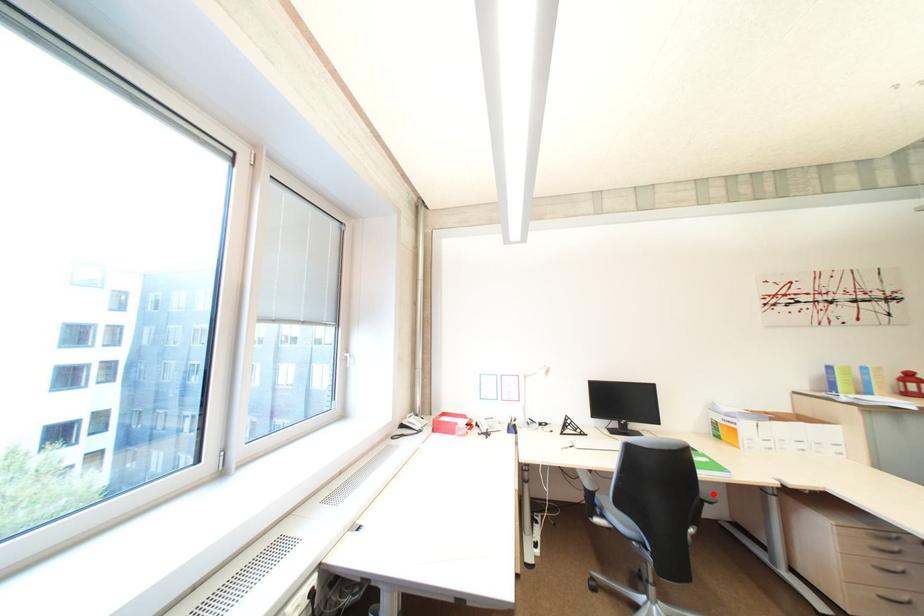
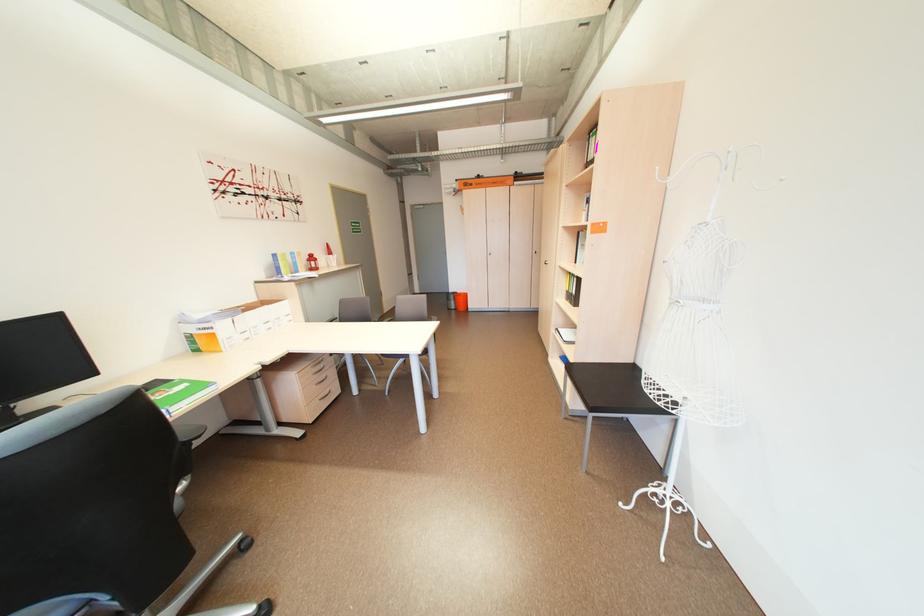
Locate, in the second image, the point that corresponds to the highlighted location in the first image.

(193, 436)